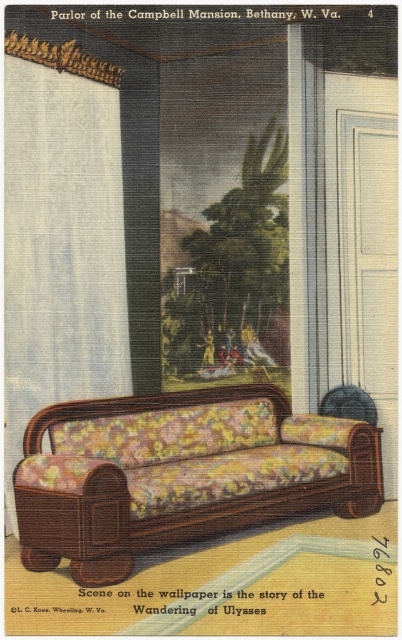
Based on the scene described in the vintage postcard of the Campbell Mansion parlor, you are planning to place a new rectangular side table between the floral fabric couch at center and the white textured curtain at left. Considering the spatial arrangement, which object should the side table be closer to, the couch or the curtain?

The side table should be placed closer to the white textured curtain at left because the floral fabric couch at center might be wider than the white textured curtain at left, leaving less space between them. To ensure the table fits properly, positioning it near the curtain would provide adequate space.

In the Campbell Mansion parlor, you see a floral fabric couch at center and a white textured curtain at left. Which object is positioned to the right of the other?

The floral fabric couch at center is positioned to the right of the white textured curtain at left.

You are standing in the Campbell Mansion parlor and want to take a photo of both point (246, 480) and point (82, 182) in the scene. Since you want both points to be in focus, which point should you focus on to ensure both are sharp?

You should focus on point (82, 182) because it is farther from the camera than point (246, 480). By focusing on the farther point, the near point will also be within the depth of field, ensuring both are sharp.